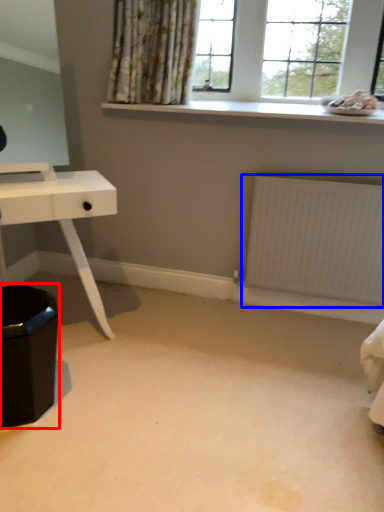
Question: Which object appears farthest to the camera in this image, step stool (highlighted by a red box) or radiator (highlighted by a blue box)?

Choices:
 (A) step stool
 (B) radiator

Answer: (B)